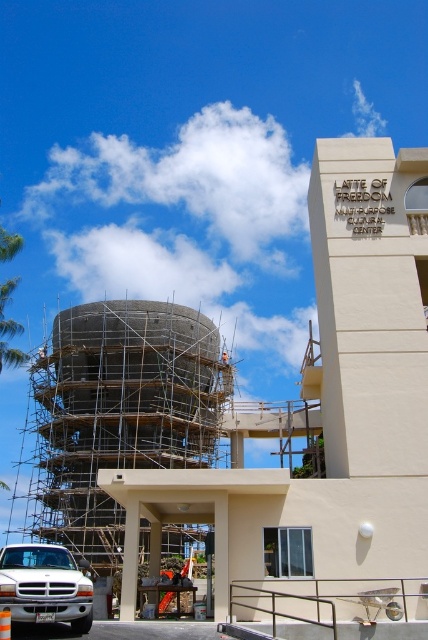
Is white matte truck at lower left thinner than green leafy palm tree at left?

Indeed, white matte truck at lower left has a lesser width compared to green leafy palm tree at left.

Does white matte truck at lower left lie in front of green leafy palm tree at left?

Yes, white matte truck at lower left is in front of green leafy palm tree at left.

Who is more distant from viewer, [12,593] or [3,237]?

Point [3,237]

Where is `white matte truck at lower left`? white matte truck at lower left is located at coordinates (44, 586).

Can you confirm if green leafy palm tree at left is bigger than orange safety vest at center?

Yes, green leafy palm tree at left is bigger than orange safety vest at center.

Is point (8, 348) farther from viewer compared to point (225, 353)?

No, (8, 348) is closer to viewer.

Find the location of `green leafy palm tree at left`. green leafy palm tree at left is located at coordinates point(8,328).

Does white matte truck at lower left have a greater width compared to orange safety vest at center?

Yes.

What do you see at coordinates (44, 586) in the screenshot? Image resolution: width=428 pixels, height=640 pixels. I see `white matte truck at lower left` at bounding box center [44, 586].

Identify the location of white matte truck at lower left. (44, 586).